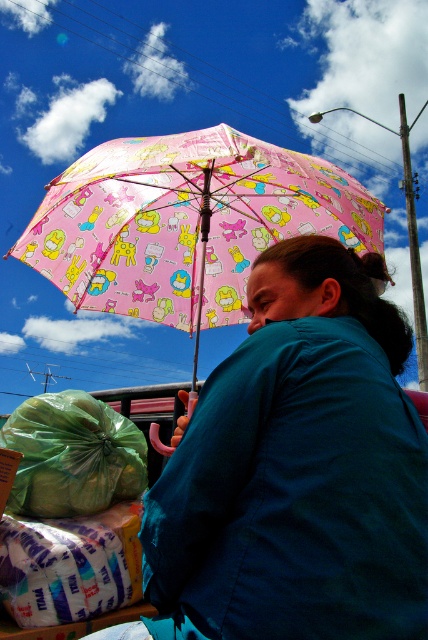
Question: Is pink fabric umbrella at upper center closer to camera compared to green plastic bag at lower left?

Choices:
 (A) yes
 (B) no

Answer: (A)

Question: Which point is farther to the camera?

Choices:
 (A) (213, 264)
 (B) (38, 483)

Answer: (A)

Question: Where is pink fabric umbrella at upper center located in relation to green plastic bag at lower left in the image?

Choices:
 (A) above
 (B) below

Answer: (A)

Question: Is pink fabric umbrella at upper center wider than green plastic bag at lower left?

Choices:
 (A) no
 (B) yes

Answer: (B)

Question: Which point appears farthest from the camera in this image?

Choices:
 (A) (374, 424)
 (B) (127, 444)
 (C) (154, 140)

Answer: (B)

Question: Which object is farther from the camera taking this photo?

Choices:
 (A) pink fabric umbrella at upper center
 (B) green plastic bag at lower left
 (C) teal fabric shirt at center

Answer: (B)